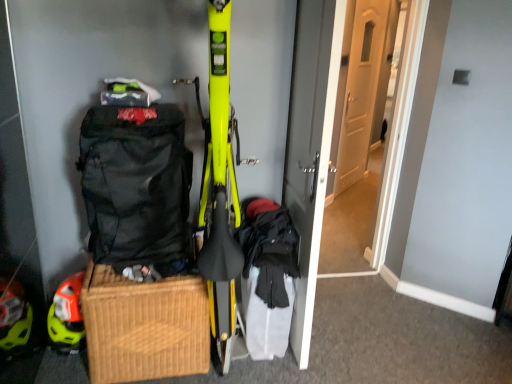
At what (x,y) coordinates should I click in order to perform the action: click on vacant point to the right of matte gray door at center, which is counted as the 1th door, starting from the left. Please return your answer as a coordinate pair (x, y). The width and height of the screenshot is (512, 384). Looking at the image, I should click on (362, 325).